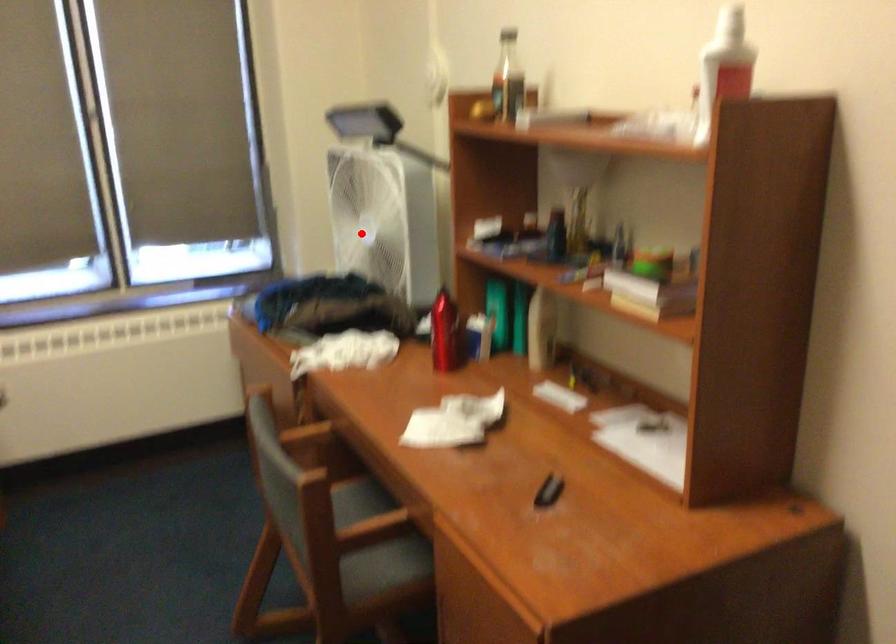
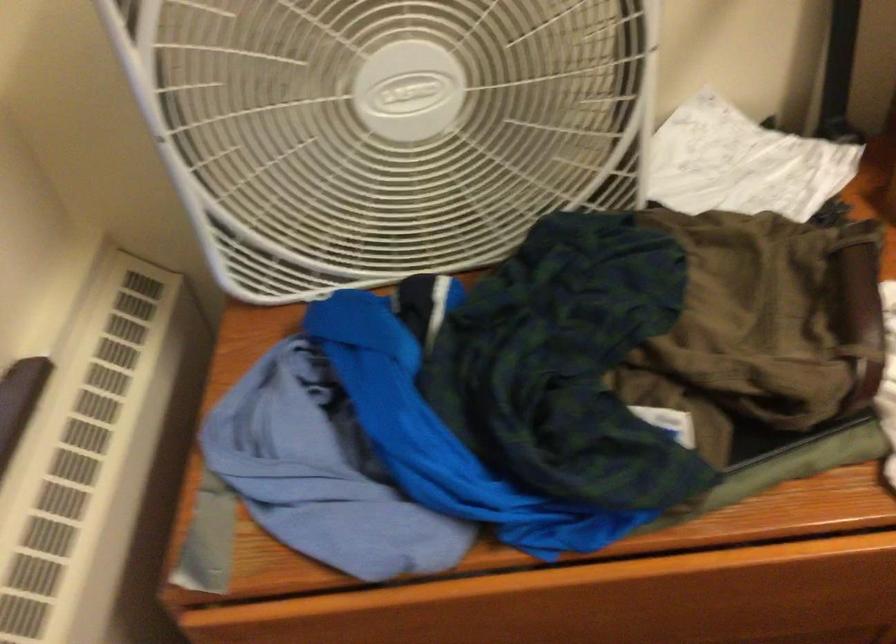
The point at the highlighted location is marked in the first image. Where is the corresponding point in the second image?

(385, 127)